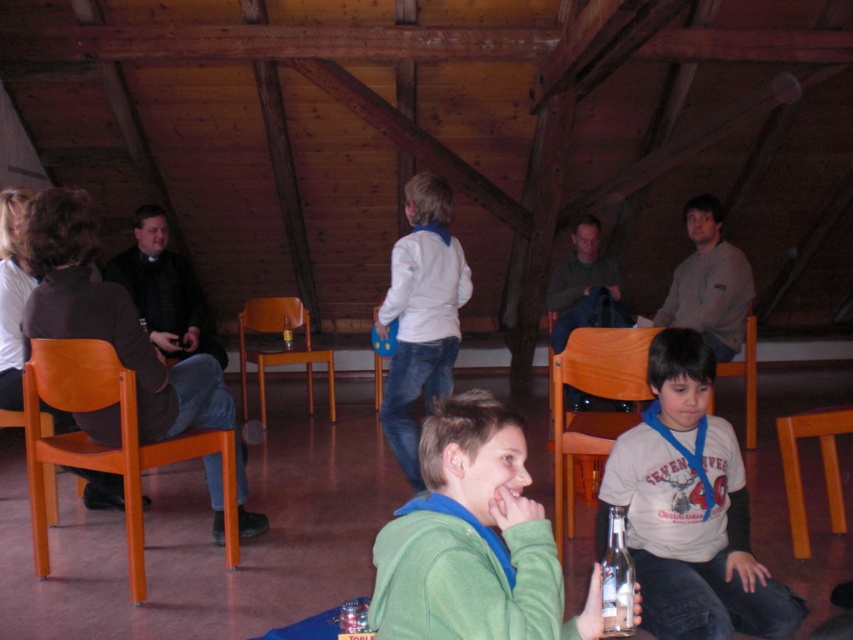
Question: Among these points, which one is nearest to the camera?

Choices:
 (A) (74, 392)
 (B) (732, 364)
 (C) (480, 472)

Answer: (C)

Question: Is matte black jacket at left to the left of black matte shirt at left from the viewer's perspective?

Choices:
 (A) no
 (B) yes

Answer: (A)

Question: Is white matte jacket at center smaller than matte green sweater at center?

Choices:
 (A) no
 (B) yes

Answer: (A)

Question: Which object is farther from the camera taking this photo?

Choices:
 (A) green fleece jacket at center
 (B) black matte shirt at left
 (C) clear glass bottle at lower center
 (D) orange wood chair at lower right

Answer: (B)

Question: Is green fleece jacket at center positioned in front of orange wood chair at lower center?

Choices:
 (A) yes
 (B) no

Answer: (A)

Question: Which object is the farthest from the orange wood chair at lower right?

Choices:
 (A) wooden chair at right
 (B) clear glass bottle at lower center
 (C) matte green sweater at center
 (D) orange wood chair at left

Answer: (D)